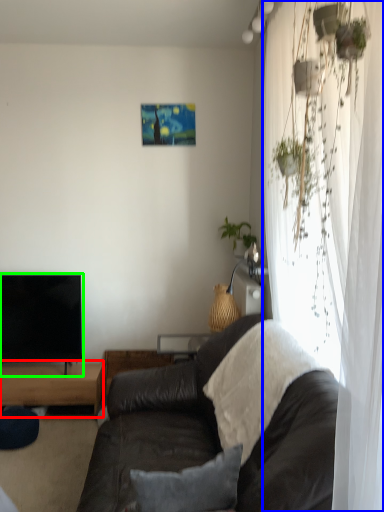
Question: Which is farther away from table (highlighted by a red box)? curtain (highlighted by a blue box) or television (highlighted by a green box)?

Choices:
 (A) curtain
 (B) television

Answer: (A)